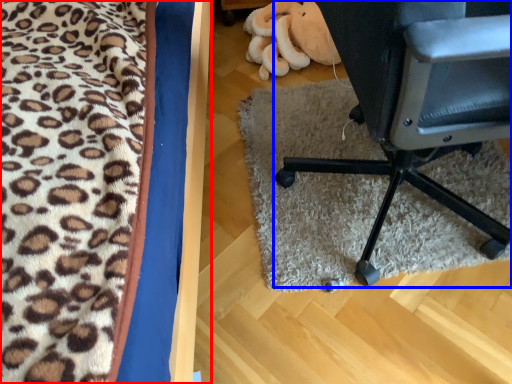
Question: Which point is closer to the camera, furniture (highlighted by a red box) or chair (highlighted by a blue box)?

Choices:
 (A) furniture
 (B) chair

Answer: (A)